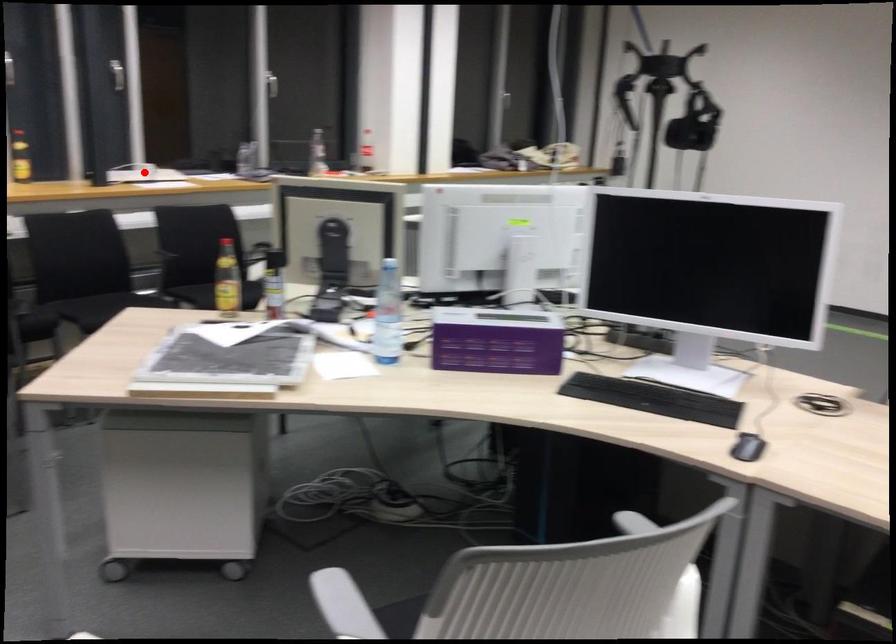
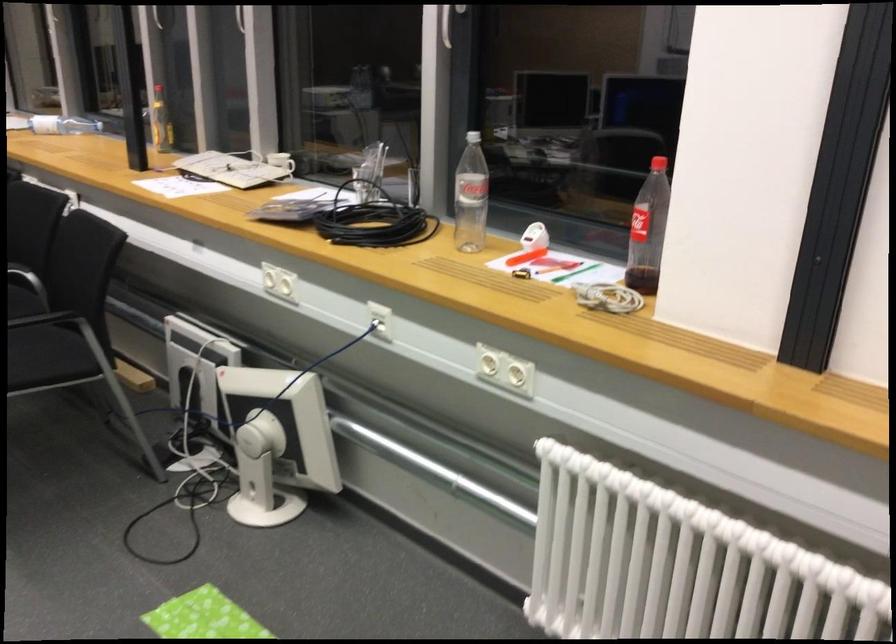
Question: I am providing you with two images of the same scene from different viewpoints. In image1, a red point is highlighted. Considering the same 3D point in image2, which of the following is correct?

Choices:
 (A) It is closer
 (B) It is farther

Answer: (A)